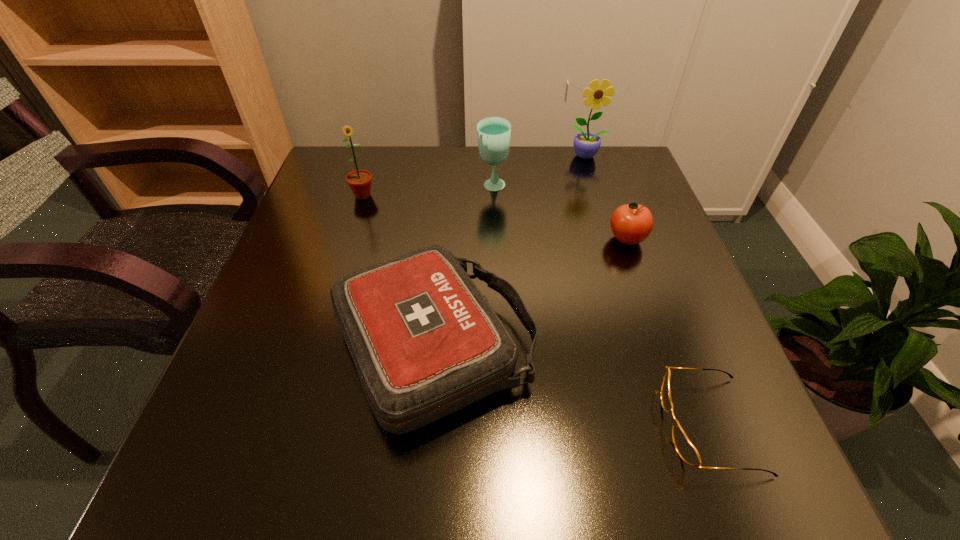
Where is `blank space located on the front of the apple`? The image size is (960, 540). blank space located on the front of the apple is located at coordinates (693, 430).

You are a GUI agent. You are given a task and a screenshot of the screen. Output one action in this format:
    pyautogui.click(x=<x>, y=<y>)
    Task: Click on the free space located on the front of the first-aid kit
    This screenshot has height=540, width=960.
    Given the screenshot: What is the action you would take?
    coord(420,488)

You are a GUI agent. You are given a task and a screenshot of the screen. Output one action in this format:
    pyautogui.click(x=<x>, y=<y>)
    Task: Click on the vacant space located 0.190m on the front-facing side of the spectacles
    
    Given the screenshot: What is the action you would take?
    pyautogui.click(x=541, y=425)

Locate an element on the screen. This screenshot has height=540, width=960. vacant area situated 0.350m on the front-facing side of the spectacles is located at coordinates (438, 425).

I want to click on vacant space situated on the front-facing side of the spectacles, so click(484, 425).

Identify the location of glass positioned at the far edge. (493, 133).

The width and height of the screenshot is (960, 540). In order to click on the first-aid kit at the near edge in this screenshot , I will do `click(425, 342)`.

Where is `spectacles positioned at the near edge`? spectacles positioned at the near edge is located at coordinates (686, 450).

Locate an element on the screen. The width and height of the screenshot is (960, 540). sunflower situated at the left edge is located at coordinates (359, 181).

Find the location of a particular element. the first-aid kit that is positioned at the left edge is located at coordinates (425, 342).